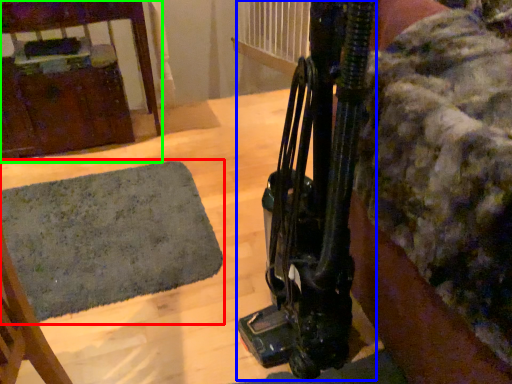
Question: Considering the real-world distances, which object is closest to mat (highlighted by a red box)? equipment (highlighted by a blue box) or furniture (highlighted by a green box).

Choices:
 (A) equipment
 (B) furniture

Answer: (B)